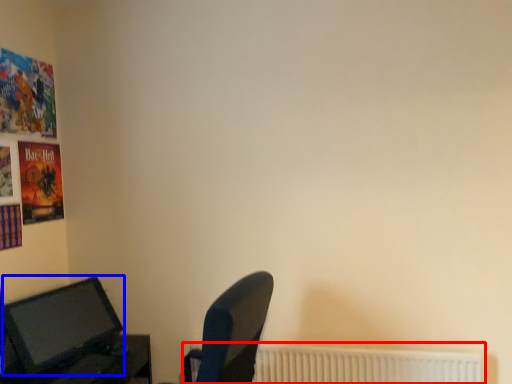
Question: Which object appears closest to the camera in this image, radiator (highlighted by a red box) or computer monitor (highlighted by a blue box)?

Choices:
 (A) radiator
 (B) computer monitor

Answer: (B)